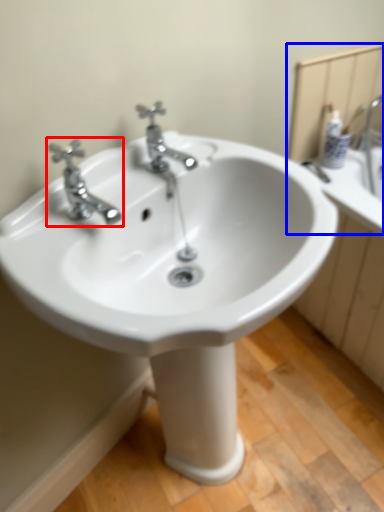
Question: Which object appears farthest to the camera in this image, tap (highlighted by a red box) or mirror (highlighted by a blue box)?

Choices:
 (A) tap
 (B) mirror

Answer: (B)